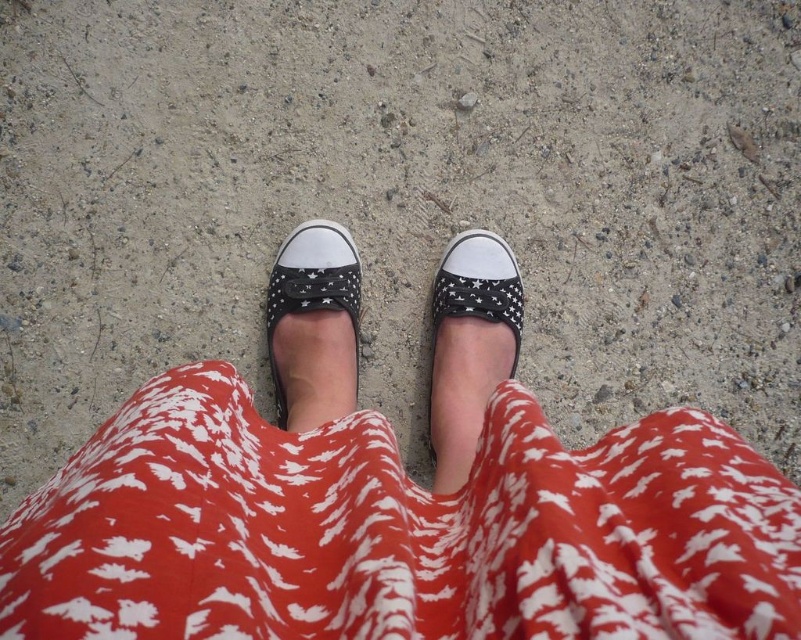
Who is taller, white canvas shoe at center or black canvas slip-on at center?

white canvas shoe at center

Is white canvas shoe at center below black canvas slip-on at center?

Yes, white canvas shoe at center is below black canvas slip-on at center.

Measure the distance between white canvas shoe at center and camera.

33.44 inches

At what (x,y) coordinates should I click in order to perform the action: click on white canvas shoe at center. Please return your answer as a coordinate pair (x, y). Image resolution: width=801 pixels, height=640 pixels. Looking at the image, I should click on (469, 346).

Is point (228, 595) farther from camera compared to point (337, 291)?

That is False.

Does white printed fabric skirt at center appear over black canvas slip-on at center?

Incorrect, white printed fabric skirt at center is not positioned above black canvas slip-on at center.

In the scene shown: Who is more forward, (538,456) or (352,324)?

Point (538,456) is in front.

In order to click on white printed fabric skirt at center in this screenshot , I will do `click(397, 531)`.

Image resolution: width=801 pixels, height=640 pixels. Describe the element at coordinates (397, 531) in the screenshot. I see `white printed fabric skirt at center` at that location.

Does white printed fabric skirt at center appear under white canvas shoe at center?

No.

Identify the location of white printed fabric skirt at center. (397, 531).